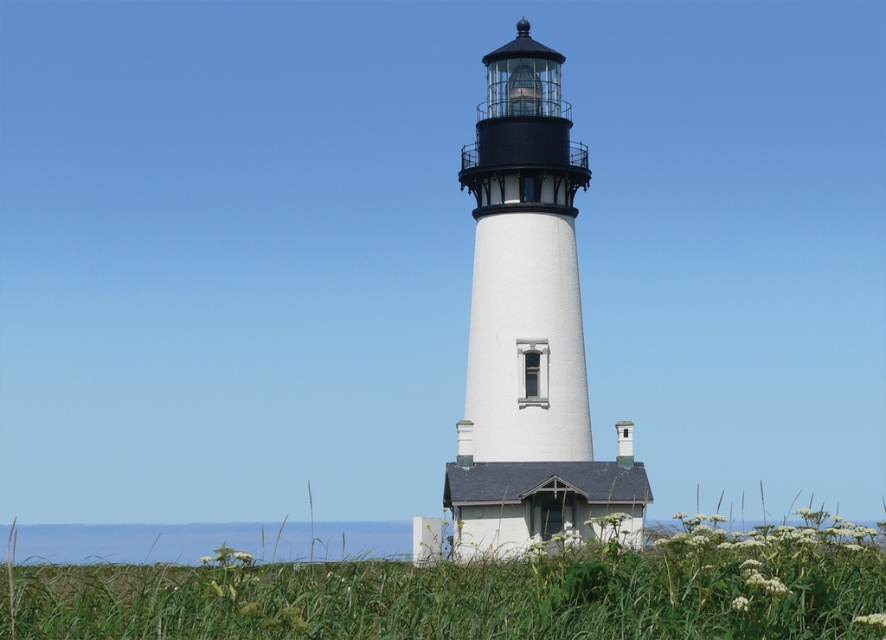
Is green grass at center shorter than white painted concrete lighthouse at center?

Correct, green grass at center is not as tall as white painted concrete lighthouse at center.

Based on the photo, does green grass at center appear over white painted concrete lighthouse at center?

No.

Between point (731, 550) and point (513, 74), which one is positioned in front?

Point (731, 550) is more forward.

In order to click on green grass at center in this screenshot , I will do `click(480, 592)`.